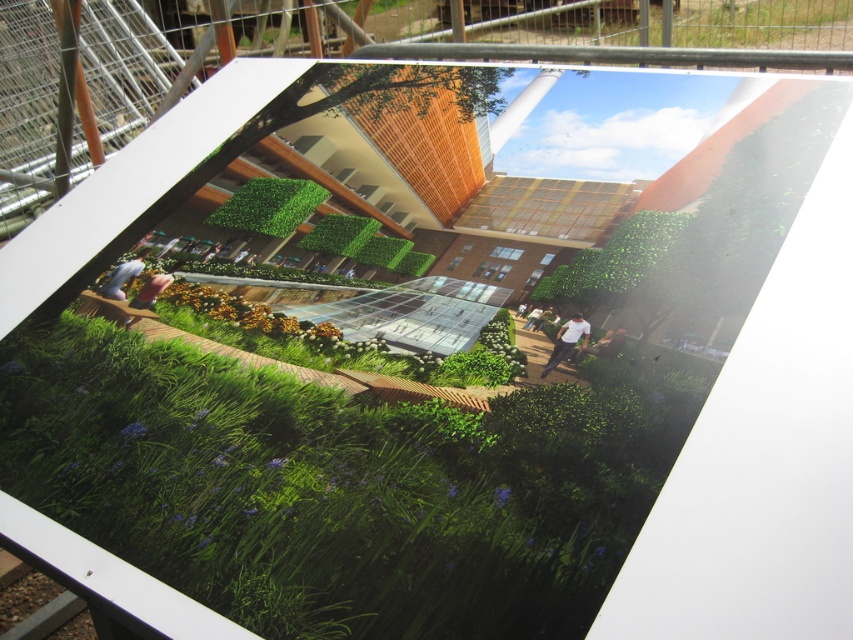
Does green grass at center have a greater width compared to white cotton shirt at center?

Indeed, green grass at center has a greater width compared to white cotton shirt at center.

Can you confirm if green grass at center is positioned to the right of white cotton shirt at center?

No, green grass at center is not to the right of white cotton shirt at center.

Who is more distant from viewer, (595, 529) or (563, 332)?

Point (563, 332)

Where is `green grass at center`? Image resolution: width=853 pixels, height=640 pixels. green grass at center is located at coordinates (337, 486).